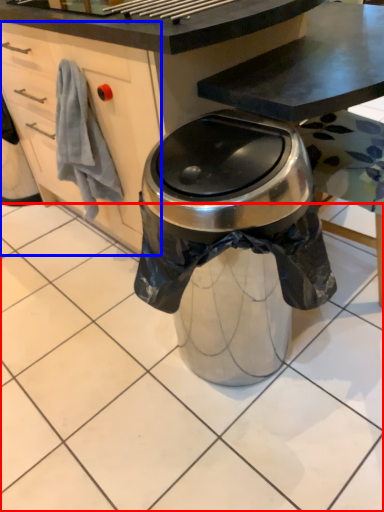
Question: Among these objects, which one is nearest to the camera, tile (highlighted by a red box) or cabinetry (highlighted by a blue box)?

Choices:
 (A) tile
 (B) cabinetry

Answer: (A)